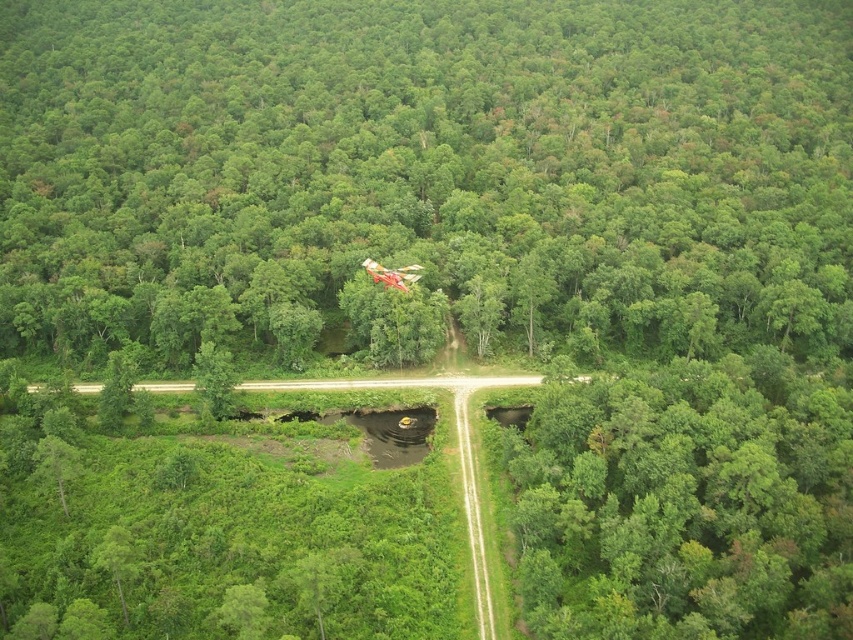
Is green leafy tree at lower right thinner than metallic red helicopter at center?

No, green leafy tree at lower right is not thinner than metallic red helicopter at center.

Between green leafy tree at lower right and metallic red helicopter at center, which one appears on the right side from the viewer's perspective?

From the viewer's perspective, green leafy tree at lower right appears more on the right side.

Describe the element at coordinates (688, 502) in the screenshot. I see `green leafy tree at lower right` at that location.

Find the location of a particular element. green leafy tree at lower right is located at coordinates (688, 502).